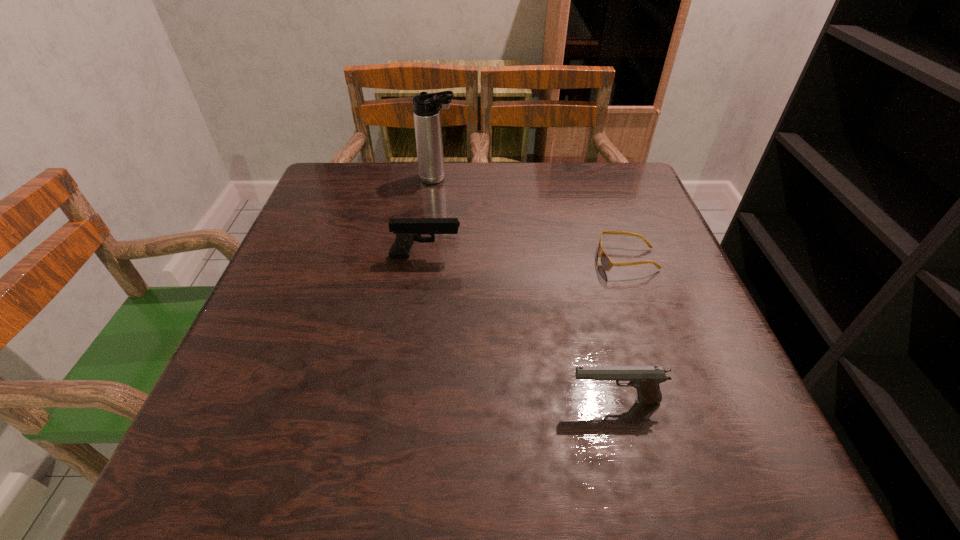
At what (x,y) coordinates should I click in order to perform the action: click on empty location between the sunglasses and the tallest object. Please return your answer as a coordinate pair (x, y). Looking at the image, I should click on (533, 219).

Identify the location of free space between the sunglasses and the farther pistol. The height and width of the screenshot is (540, 960). (526, 258).

Identify the location of free spot between the farther pistol and the tallest object. This screenshot has width=960, height=540. (432, 218).

The image size is (960, 540). What are the coordinates of `free spot between the thermos bottle and the nearest object` in the screenshot? It's located at (526, 289).

Image resolution: width=960 pixels, height=540 pixels. What are the coordinates of `object that ranks as the second closest to the left pistol` in the screenshot? It's located at (606, 263).

You are a GUI agent. You are given a task and a screenshot of the screen. Output one action in this format:
    pyautogui.click(x=<x>, y=<y>)
    Task: Click on the object that can be found as the second closest to the sunglasses
    
    Given the screenshot: What is the action you would take?
    pyautogui.click(x=407, y=230)